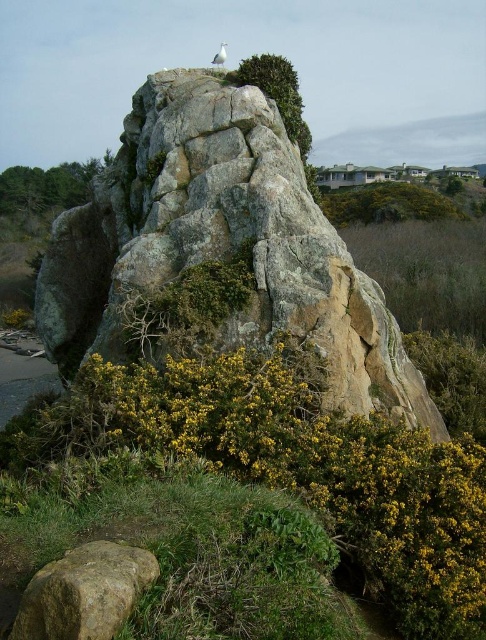
Question: Which point is farther to the camera?

Choices:
 (A) white glossy bird at upper center
 (B) green leafy shrub at upper center

Answer: (A)

Question: Which point is closer to the camera taking this photo?

Choices:
 (A) (324, 445)
 (B) (152, 285)
 (C) (221, 64)

Answer: (A)

Question: Does smooth brown rock at lower left appear on the left side of white glossy bird at upper center?

Choices:
 (A) yes
 (B) no

Answer: (B)

Question: Is smooth brown rock at lower left above green leafy tree at upper right?

Choices:
 (A) no
 (B) yes

Answer: (A)

Question: Is yellow matte flower at lower center positioned in front of rough textured rock at center?

Choices:
 (A) no
 (B) yes

Answer: (B)

Question: Which point is closer to the camera?

Choices:
 (A) green leafy tree at upper right
 (B) rough textured rock at center
 (C) yellow matte flower at lower center

Answer: (C)